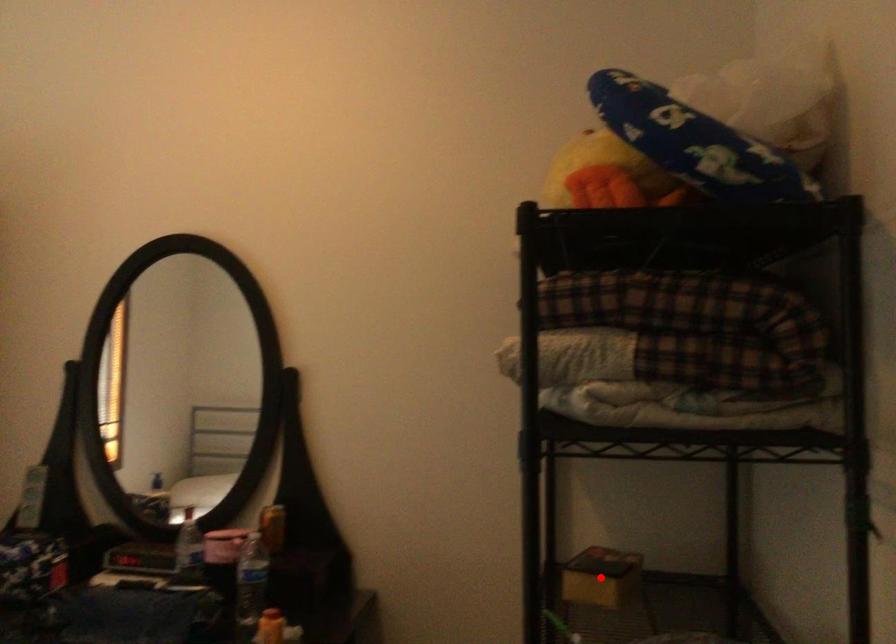
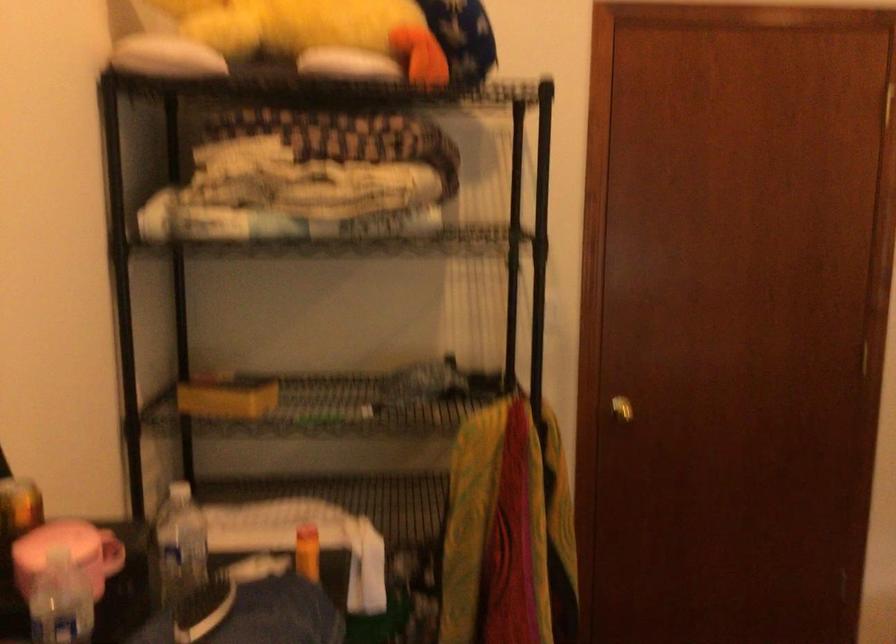
Question: I am providing you with two images of the same scene from different viewpoints. A red point is marked on the first image. At the location where the point appears in image 1, is it still visible in image 2?

Choices:
 (A) Yes
 (B) No

Answer: (B)